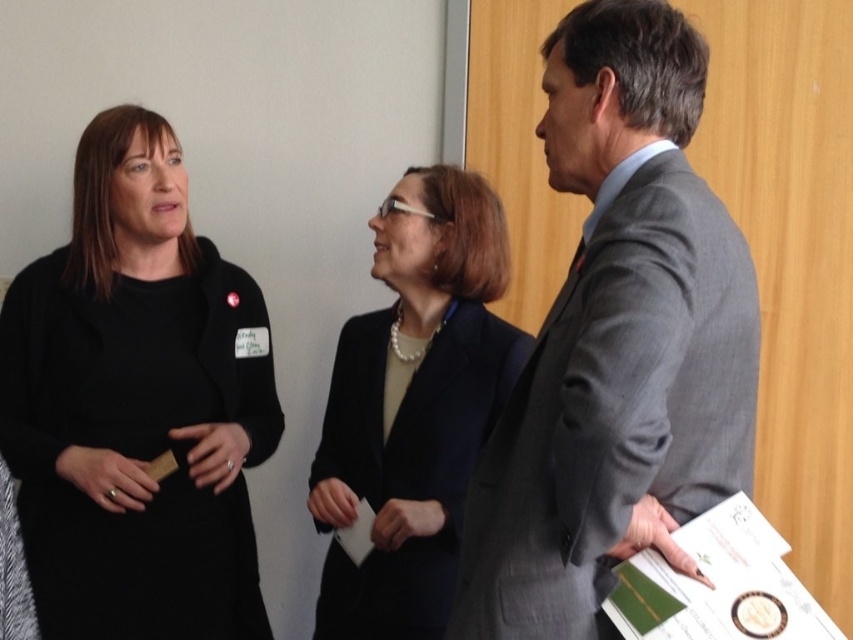
You are standing in the room and want to hand a document to both the gray suit at center and the black matte dress at left. Which one should you approach first to ensure you can reach them both without moving around furniture?

You should approach the gray suit at center first since they are closer to you than the black matte dress at left, allowing you to reach them both more efficiently without needing to move around furniture.

You are standing in the conference room and see two points marked on the floor. The first point is at coordinates point (451, 628) and the second is at point (112, 134). If you were to walk from the first point to the second, would you be moving towards the wall with wooden paneling or away from it?

The point at (451, 628) is in front of the point at (112, 134). Since the wooden paneling is in the background, moving from the first point to the second would mean moving towards the wall with wooden paneling.